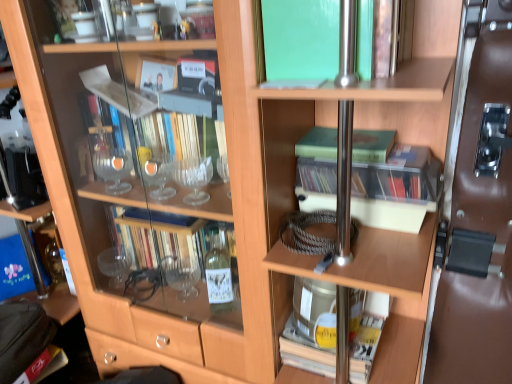
Question: Is clear plastic case at center, which appears as the second book when ordered from the bottom, closer to camera compared to metallic silver book at center, which appears as the fifth book when viewed from the top?

Choices:
 (A) no
 (B) yes

Answer: (B)

Question: Is clear plastic case at center, the fourth book in the top-to-bottom sequence, positioned beyond the bounds of metallic silver book at center, which is the 1th book in bottom-to-top order?

Choices:
 (A) yes
 (B) no

Answer: (A)

Question: Does clear plastic case at center, the fourth book in the top-to-bottom sequence, have a lesser width compared to metallic silver book at center, which is the 1th book in bottom-to-top order?

Choices:
 (A) yes
 (B) no

Answer: (A)

Question: Can you confirm if clear plastic case at center, which appears as the second book when ordered from the bottom, is bigger than metallic silver book at center, which appears as the fifth book when viewed from the top?

Choices:
 (A) yes
 (B) no

Answer: (B)

Question: From the image's perspective, would you say clear plastic case at center, which appears as the second book when ordered from the bottom, is positioned over metallic silver book at center, which appears as the fifth book when viewed from the top?

Choices:
 (A) yes
 (B) no

Answer: (A)

Question: Can you confirm if metallic silver book at center, which is the 1th book in bottom-to-top order, is positioned to the left of translucent plastic case at center, which ranks as the 3th book in bottom-to-top order?

Choices:
 (A) no
 (B) yes

Answer: (B)

Question: Is metallic silver book at center, which is the 1th book in bottom-to-top order, turned away from translucent plastic case at center, which appears as the 3th book when viewed from the top?

Choices:
 (A) yes
 (B) no

Answer: (B)

Question: Is metallic silver book at center, which is the 1th book in bottom-to-top order, not close to translucent plastic case at center, which appears as the 3th book when viewed from the top?

Choices:
 (A) no
 (B) yes

Answer: (A)

Question: Is metallic silver book at center, which appears as the fifth book when viewed from the top, thinner than translucent plastic case at center, which appears as the 3th book when viewed from the top?

Choices:
 (A) yes
 (B) no

Answer: (B)

Question: Does metallic silver book at center, which appears as the fifth book when viewed from the top, have a greater height compared to translucent plastic case at center, which appears as the 3th book when viewed from the top?

Choices:
 (A) yes
 (B) no

Answer: (A)

Question: Is metallic silver book at center, which is the 1th book in bottom-to-top order, beside translucent plastic case at center, which ranks as the 3th book in bottom-to-top order?

Choices:
 (A) no
 (B) yes

Answer: (A)

Question: Can you confirm if leather handbag at lower left is bigger than brown leather door at right?

Choices:
 (A) yes
 (B) no

Answer: (B)